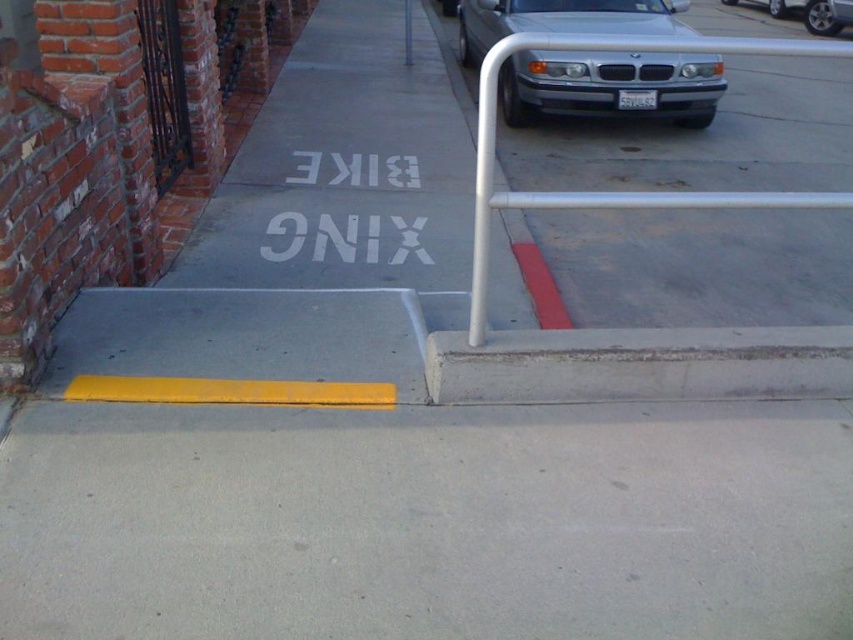
This screenshot has height=640, width=853. In order to click on silver metallic car at upper center in this screenshot , I will do `click(611, 84)`.

Between silver metallic car at upper center and silver metallic car at upper right, which one appears on the right side from the viewer's perspective?

silver metallic car at upper right is more to the right.

Which is in front, point (579, 8) or point (781, 16)?

Point (579, 8)

Identify the location of silver metallic car at upper center. (611, 84).

Which is more to the right, concrete at lower center or yellow painted pole at upper center?

From the viewer's perspective, concrete at lower center appears more on the right side.

Which is below, concrete at lower center or yellow painted pole at upper center?

concrete at lower center is below.

Looking at this image, who is more distant from viewer, (x=645, y=330) or (x=408, y=16)?

Positioned behind is point (x=408, y=16).

The width and height of the screenshot is (853, 640). Find the location of `concrete at lower center`. concrete at lower center is located at coordinates (639, 364).

Is point (730, 3) more distant than point (408, 13)?

Yes.

Does silver metallic car at upper right have a lesser height compared to yellow painted pole at upper center?

No.

Who is more forward, (788, 4) or (408, 3)?

Point (408, 3)

Find the location of `silver metallic car at upper right`. silver metallic car at upper right is located at coordinates (811, 12).